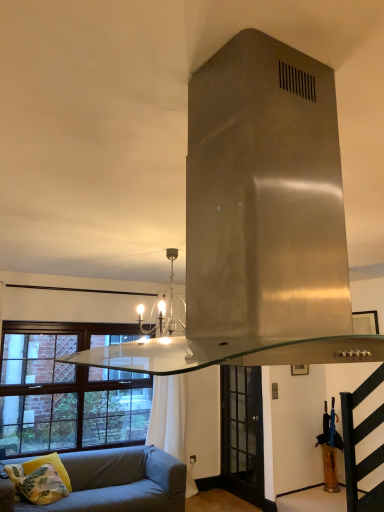
Looking at this image, measure the distance between point (125, 485) and camera.

Point (125, 485) and camera are 4.27 meters apart.

Find the location of `yellow fabric pillow at lower left, arranged as the second pillow when viewed from the left`. yellow fabric pillow at lower left, arranged as the second pillow when viewed from the left is located at coordinates (51, 464).

This screenshot has width=384, height=512. What are the coordinates of `clear glass door at center` in the screenshot? It's located at (242, 433).

In order to face clear glass door at center, should I rotate leftwards or rightwards?

You should rotate right by 6.734 degrees.

Image resolution: width=384 pixels, height=512 pixels. I want to click on light blue fabric studio couch at lower left, so click(115, 482).

From the picture: From the image's perspective, is brown wooden window at lower left located above or below matte black chandelier at center?

brown wooden window at lower left is below matte black chandelier at center.

Is brown wooden window at lower left far from matte black chandelier at center?

Yes.

Could you tell me if brown wooden window at lower left is turned towards matte black chandelier at center?

Yes, brown wooden window at lower left is aimed at matte black chandelier at center.

Is light blue fabric studio couch at lower left outside of matte black chandelier at center?

That's correct, light blue fabric studio couch at lower left is outside of matte black chandelier at center.

Can you confirm if light blue fabric studio couch at lower left is thinner than matte black chandelier at center?

In fact, light blue fabric studio couch at lower left might be wider than matte black chandelier at center.

Is point (79, 500) farther from camera compared to point (181, 321)?

Yes, point (79, 500) is behind point (181, 321).

From a real-world perspective, does light blue fabric studio couch at lower left stand above matte black chandelier at center?

No, from a real-world perspective, light blue fabric studio couch at lower left is not over matte black chandelier at center

Who is taller, clear glass door at center or light blue fabric studio couch at lower left?

Standing taller between the two is clear glass door at center.

Who is bigger, clear glass door at center or light blue fabric studio couch at lower left?

With larger size is light blue fabric studio couch at lower left.

Measure the distance between clear glass door at center and light blue fabric studio couch at lower left.

A distance of 1.70 meters exists between clear glass door at center and light blue fabric studio couch at lower left.

In the scene shown: Considering the sizes of objects clear glass door at center and light blue fabric studio couch at lower left in the image provided, who is thinner, clear glass door at center or light blue fabric studio couch at lower left?

clear glass door at center is thinner.

Is brown wooden window at lower left situated inside light blue fabric studio couch at lower left or outside?

brown wooden window at lower left is not inside light blue fabric studio couch at lower left, it's outside.

Is brown wooden window at lower left positioned with its back to light blue fabric studio couch at lower left?

No, light blue fabric studio couch at lower left is not at the back of brown wooden window at lower left.

Is brown wooden window at lower left directly adjacent to light blue fabric studio couch at lower left?

No, brown wooden window at lower left is not making contact with light blue fabric studio couch at lower left.

Does point (97, 373) appear closer or farther from the camera than point (10, 500)?

Point (97, 373) appears to be farther away from the viewer than point (10, 500).

Considering the relative positions of clear glass door at center and yellow fabric pillow at lower left, which is the first pillow from right to left, in the image provided, is clear glass door at center to the left of yellow fabric pillow at lower left, which is the first pillow from right to left, from the viewer's perspective?

No.

Is clear glass door at center far from yellow fabric pillow at lower left, which is the first pillow from right to left?

That's right, there is a large distance between clear glass door at center and yellow fabric pillow at lower left, which is the first pillow from right to left.

Which object is thinner, clear glass door at center or yellow fabric pillow at lower left, arranged as the second pillow when viewed from the left?

clear glass door at center is thinner.

Where is `the 2nd pillow below the clear glass door at center (from a real-world perspective)`? Image resolution: width=384 pixels, height=512 pixels. the 2nd pillow below the clear glass door at center (from a real-world perspective) is located at coordinates (37, 484).

Considering the positions of objects clear glass door at center and yellow floral pillow at lower left, marked as the second pillow in a right-to-left arrangement, in the image provided, who is more to the right, clear glass door at center or yellow floral pillow at lower left, marked as the second pillow in a right-to-left arrangement,?

clear glass door at center.

Are clear glass door at center and yellow floral pillow at lower left, marked as the second pillow in a right-to-left arrangement, far apart?

clear glass door at center is far away from yellow floral pillow at lower left, marked as the second pillow in a right-to-left arrangement.

Is clear glass door at center surrounding yellow floral pillow at lower left, marked as the second pillow in a right-to-left arrangement?

No, yellow floral pillow at lower left, marked as the second pillow in a right-to-left arrangement, is located outside of clear glass door at center.

Consider the image. Is light blue fabric studio couch at lower left facing away from yellow floral pillow at lower left, marked as the 1th pillow in a left-to-right arrangement?

Absolutely, light blue fabric studio couch at lower left is directed away from yellow floral pillow at lower left, marked as the 1th pillow in a left-to-right arrangement.

Which point is more distant from viewer, (99,459) or (39,472)?

The point (99,459) is farther.

From the picture: Considering the relative sizes of light blue fabric studio couch at lower left and yellow floral pillow at lower left, marked as the 1th pillow in a left-to-right arrangement, in the image provided, is light blue fabric studio couch at lower left taller than yellow floral pillow at lower left, marked as the 1th pillow in a left-to-right arrangement,?

Indeed, light blue fabric studio couch at lower left has a greater height compared to yellow floral pillow at lower left, marked as the 1th pillow in a left-to-right arrangement.

Find the location of `window that appears behind the matte black chandelier at center`. window that appears behind the matte black chandelier at center is located at coordinates (67, 390).

Identify the location of studio couch on the left of matte black chandelier at center. (115, 482).

Considering their positions, is yellow floral pillow at lower left, marked as the 1th pillow in a left-to-right arrangement, positioned closer to matte black chandelier at center than yellow fabric pillow at lower left, arranged as the second pillow when viewed from the left?

Among the two, yellow floral pillow at lower left, marked as the 1th pillow in a left-to-right arrangement, is located nearer to matte black chandelier at center.

Based on the photo, looking at the image, which one is located closer to clear glass door at center, matte black chandelier at center or brown wooden window at lower left?

Among the two, brown wooden window at lower left is located nearer to clear glass door at center.

Based on the photo, considering their positions, is yellow floral pillow at lower left, marked as the second pillow in a right-to-left arrangement, positioned closer to matte black chandelier at center than brown wooden window at lower left?

brown wooden window at lower left is positioned closer to the anchor matte black chandelier at center.

From the image, which object appears to be nearer to yellow floral pillow at lower left, marked as the 1th pillow in a left-to-right arrangement, light blue fabric studio couch at lower left or yellow fabric pillow at lower left, which is the first pillow from right to left?

Among the two, yellow fabric pillow at lower left, which is the first pillow from right to left, is located nearer to yellow floral pillow at lower left, marked as the 1th pillow in a left-to-right arrangement.

Which object lies nearer to the anchor point matte black chandelier at center, clear glass door at center or yellow fabric pillow at lower left, arranged as the second pillow when viewed from the left?

yellow fabric pillow at lower left, arranged as the second pillow when viewed from the left, is closer to matte black chandelier at center.

Considering their positions, is yellow fabric pillow at lower left, which is the first pillow from right to left, positioned closer to yellow floral pillow at lower left, marked as the second pillow in a right-to-left arrangement, than brown wooden window at lower left?

The object closer to yellow floral pillow at lower left, marked as the second pillow in a right-to-left arrangement, is yellow fabric pillow at lower left, which is the first pillow from right to left.

When comparing their distances from yellow floral pillow at lower left, marked as the 1th pillow in a left-to-right arrangement, does yellow fabric pillow at lower left, arranged as the second pillow when viewed from the left, or light blue fabric studio couch at lower left seem closer?

yellow fabric pillow at lower left, arranged as the second pillow when viewed from the left, is positioned closer to the anchor yellow floral pillow at lower left, marked as the 1th pillow in a left-to-right arrangement.

Looking at this image, estimate the real-world distances between objects in this image. Which object is further from yellow fabric pillow at lower left, which is the first pillow from right to left, yellow floral pillow at lower left, marked as the second pillow in a right-to-left arrangement, or matte black chandelier at center?

Based on the image, matte black chandelier at center appears to be further to yellow fabric pillow at lower left, which is the first pillow from right to left.

Where is `studio couch between yellow fabric pillow at lower left, arranged as the second pillow when viewed from the left, and clear glass door at center, in the horizontal direction`? The width and height of the screenshot is (384, 512). studio couch between yellow fabric pillow at lower left, arranged as the second pillow when viewed from the left, and clear glass door at center, in the horizontal direction is located at coordinates (115, 482).

The height and width of the screenshot is (512, 384). In order to click on glass door between matte black chandelier at center and light blue fabric studio couch at lower left from top to bottom in this screenshot , I will do `click(242, 433)`.

Where is `pillow between light blue fabric studio couch at lower left and yellow fabric pillow at lower left, arranged as the second pillow when viewed from the left, from front to back`? pillow between light blue fabric studio couch at lower left and yellow fabric pillow at lower left, arranged as the second pillow when viewed from the left, from front to back is located at coordinates pos(37,484).

Identify the location of pillow between matte black chandelier at center and yellow fabric pillow at lower left, arranged as the second pillow when viewed from the left, from top to bottom. The width and height of the screenshot is (384, 512). (37, 484).